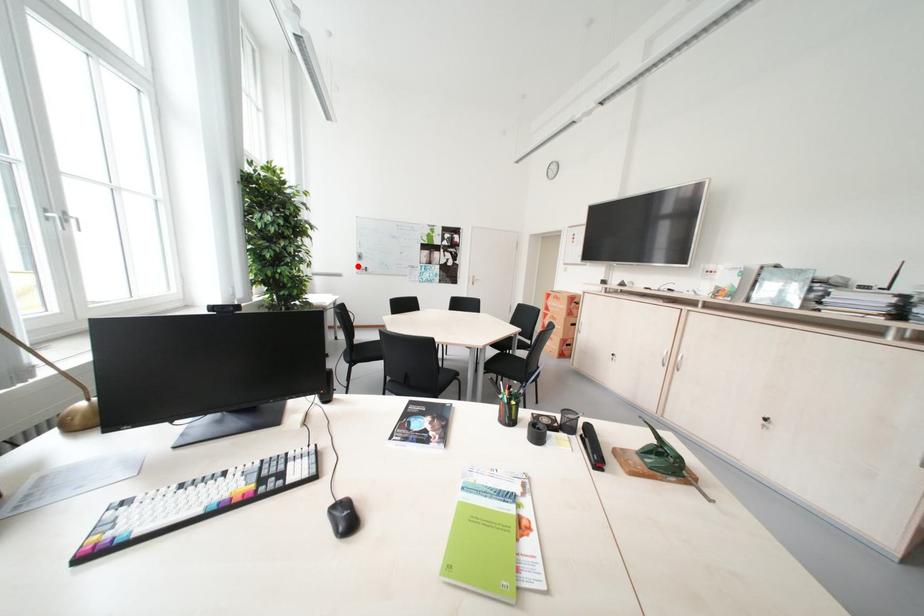
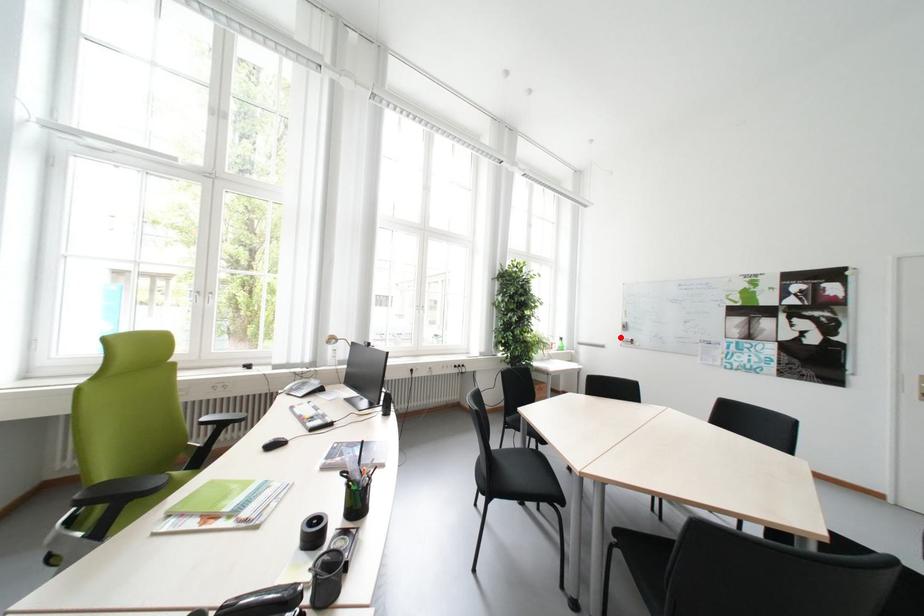
I am providing you with two images of the same scene from different viewpoints. A red point is marked on the first image and another point is marked on the second image. Is the red point in image1 aligned with the point shown in image2?

Yes